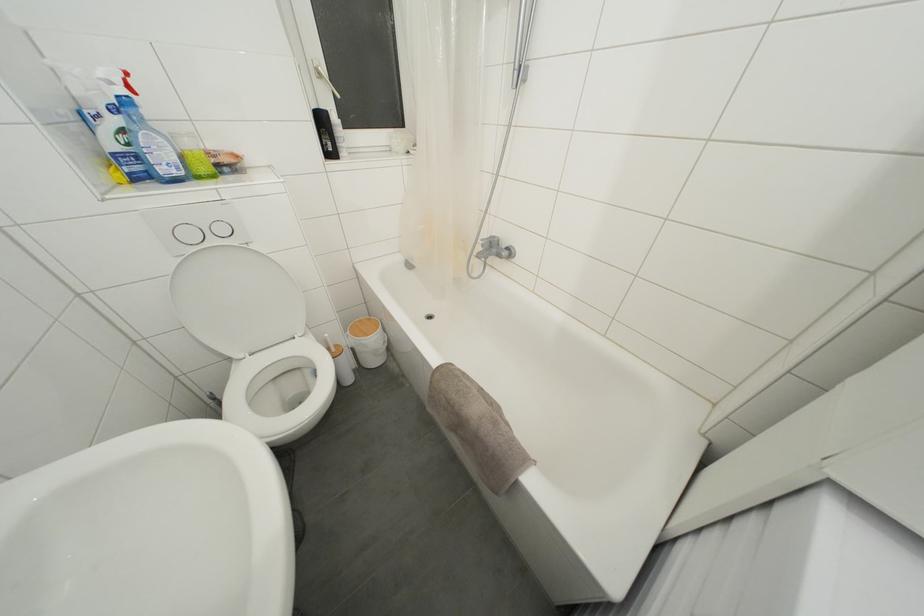
What do you see at coordinates (362, 328) in the screenshot?
I see `the wooden trash can lid` at bounding box center [362, 328].